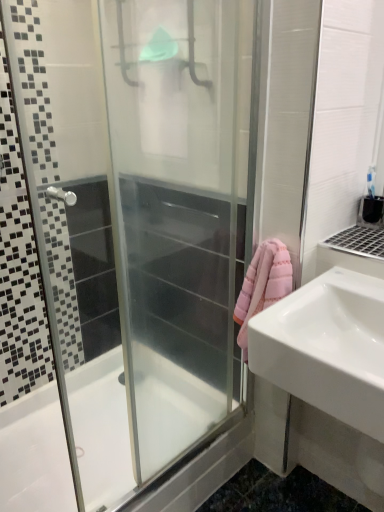
Question: Can you confirm if white glossy sink at right is positioned to the right of transparent glass shower door at center?

Choices:
 (A) yes
 (B) no

Answer: (A)

Question: Is transparent glass shower door at center located within white glossy sink at right?

Choices:
 (A) yes
 (B) no

Answer: (B)

Question: Is white glossy sink at right placed right next to transparent glass shower door at center?

Choices:
 (A) yes
 (B) no

Answer: (B)

Question: From the image's perspective, would you say white glossy sink at right is shown under transparent glass shower door at center?

Choices:
 (A) yes
 (B) no

Answer: (A)

Question: From the image's perspective, is white glossy sink at right on transparent glass shower door at center?

Choices:
 (A) yes
 (B) no

Answer: (B)

Question: In the image, is white glossy bathtub at lower left on the left side or the right side of white glossy sink at right?

Choices:
 (A) left
 (B) right

Answer: (A)

Question: Is white glossy bathtub at lower left inside the boundaries of white glossy sink at right, or outside?

Choices:
 (A) outside
 (B) inside

Answer: (A)

Question: In the image, is white glossy bathtub at lower left positioned in front of or behind white glossy sink at right?

Choices:
 (A) behind
 (B) front

Answer: (A)

Question: Considering the positions of white glossy bathtub at lower left and white glossy sink at right in the image, is white glossy bathtub at lower left bigger or smaller than white glossy sink at right?

Choices:
 (A) big
 (B) small

Answer: (A)

Question: From a real-world perspective, relative to white glossy bathtub at lower left, is white glossy sink at right vertically above or below?

Choices:
 (A) above
 (B) below

Answer: (A)

Question: Which is correct: white glossy sink at right is inside white glossy bathtub at lower left, or outside of it?

Choices:
 (A) inside
 (B) outside

Answer: (B)

Question: Considering the positions of white glossy sink at right and white glossy bathtub at lower left in the image, is white glossy sink at right wider or thinner than white glossy bathtub at lower left?

Choices:
 (A) wide
 (B) thin

Answer: (B)

Question: Considering the positions of point (289, 301) and point (117, 437), is point (289, 301) closer or farther from the camera than point (117, 437)?

Choices:
 (A) closer
 (B) farther

Answer: (A)

Question: Visually, is transparent glass shower door at center positioned to the left or to the right of white glossy bathtub at lower left?

Choices:
 (A) right
 (B) left

Answer: (A)

Question: From the image's perspective, is transparent glass shower door at center positioned above or below white glossy bathtub at lower left?

Choices:
 (A) below
 (B) above

Answer: (B)